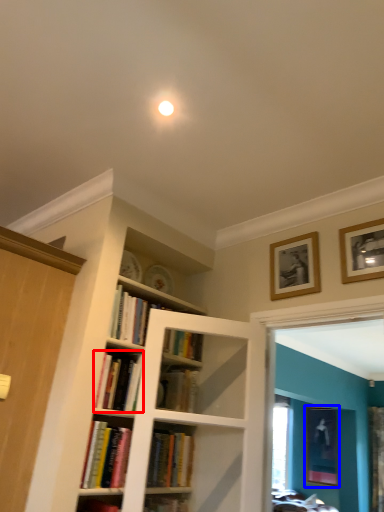
Question: Which of the following is the closest to the observer, book (highlighted by a red box) or picture frame (highlighted by a blue box)?

Choices:
 (A) book
 (B) picture frame

Answer: (A)